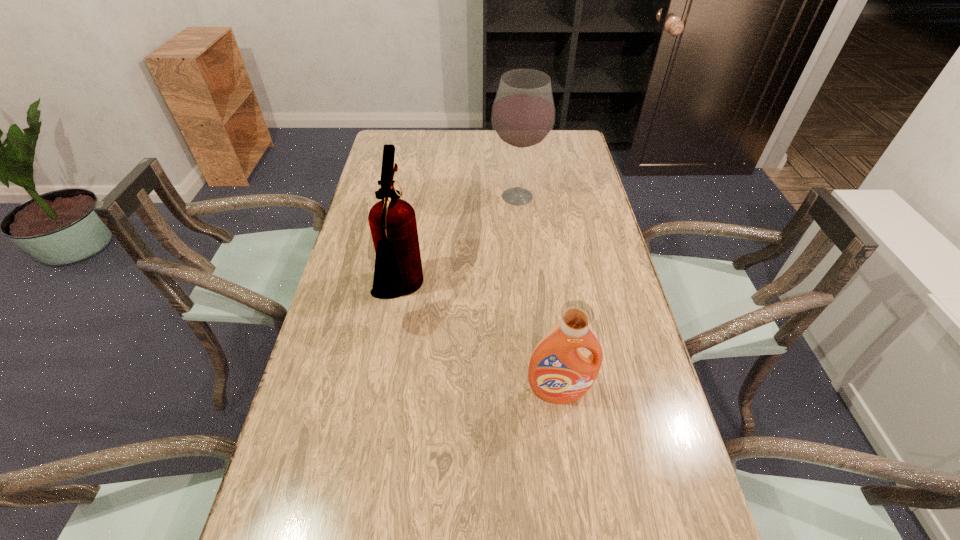
At what (x,y) coordinates should I click in order to perform the action: click on free space between the leftmost object and the farthest object. Please return your answer as a coordinate pair (x, y). The image size is (960, 540). Looking at the image, I should click on (460, 245).

At what (x,y) coordinates should I click in order to perform the action: click on object that is the second closest to the second nearest object. Please return your answer as a coordinate pair (x, y). This screenshot has width=960, height=540. Looking at the image, I should click on (559, 372).

This screenshot has width=960, height=540. I want to click on object that is the second closest one to the alcohol, so click(559, 372).

Identify the location of blank area in the image that satisfies the following two spatial constraints: 1. on the front side of the farthest object; 2. at the nozzle of the second farthest object. (527, 293).